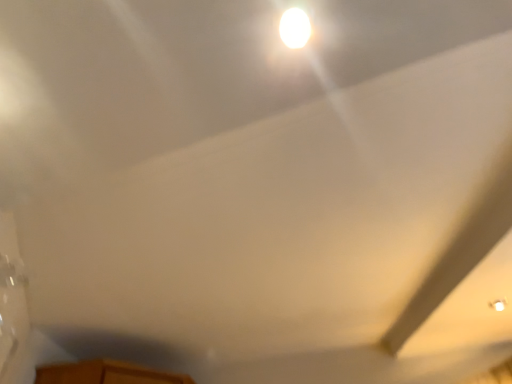
Describe the element at coordinates (464, 279) in the screenshot. Image resolution: width=512 pixels, height=384 pixels. I see `white matte exhaust hood at upper right` at that location.

Locate an element on the screen. white matte exhaust hood at upper right is located at coordinates (464, 279).

Image resolution: width=512 pixels, height=384 pixels. What do you see at coordinates (295, 28) in the screenshot?
I see `white glossy light bulb at upper center` at bounding box center [295, 28].

Where is `white glossy light bulb at upper center`? white glossy light bulb at upper center is located at coordinates (295, 28).

Identify the location of white matte exhaust hood at upper right. click(x=464, y=279).

Which object is positioned more to the left, white glossy light bulb at upper center or white matte exhaust hood at upper right?

white glossy light bulb at upper center.

Is white glossy light bulb at upper center in front of or behind white matte exhaust hood at upper right in the image?

Clearly, white glossy light bulb at upper center is in front of white matte exhaust hood at upper right.

Is point (281, 34) in front of point (495, 216)?

Yes.

From the image's perspective, is white glossy light bulb at upper center positioned above or below white matte exhaust hood at upper right?

white glossy light bulb at upper center is situated higher than white matte exhaust hood at upper right in the image.

From a real-world perspective, between white glossy light bulb at upper center and white matte exhaust hood at upper right, who is vertically higher?

In real-world perspective, white matte exhaust hood at upper right is above.

Considering the sizes of objects white glossy light bulb at upper center and white matte exhaust hood at upper right in the image provided, who is thinner, white glossy light bulb at upper center or white matte exhaust hood at upper right?

Answer: With smaller width is white glossy light bulb at upper center.

Can you confirm if white glossy light bulb at upper center is taller than white matte exhaust hood at upper right?

No, white glossy light bulb at upper center is not taller than white matte exhaust hood at upper right.

Considering the relative sizes of white glossy light bulb at upper center and white matte exhaust hood at upper right in the image provided, is white glossy light bulb at upper center bigger than white matte exhaust hood at upper right?

No.

Do you think white glossy light bulb at upper center is within white matte exhaust hood at upper right, or outside of it?

white glossy light bulb at upper center cannot be found inside white matte exhaust hood at upper right.

Is white glossy light bulb at upper center far from white matte exhaust hood at upper right?

That's right, there is a large distance between white glossy light bulb at upper center and white matte exhaust hood at upper right.

Could you tell me if white glossy light bulb at upper center is facing white matte exhaust hood at upper right?

No.

Can you tell me how much white glossy light bulb at upper center and white matte exhaust hood at upper right differ in facing direction?

They differ by 179 degrees in their facing directions.

Image resolution: width=512 pixels, height=384 pixels. Find the location of `light that appears below the white matte exhaust hood at upper right (from a real-world perspective)`. light that appears below the white matte exhaust hood at upper right (from a real-world perspective) is located at coordinates (295, 28).

Between white matte exhaust hood at upper right and white glossy light bulb at upper center, which one appears on the left side from the viewer's perspective?

Positioned to the left is white glossy light bulb at upper center.

Considering the positions of objects white matte exhaust hood at upper right and white glossy light bulb at upper center in the image provided, who is behind, white matte exhaust hood at upper right or white glossy light bulb at upper center?

Positioned behind is white matte exhaust hood at upper right.

Is point (475, 273) behind point (295, 22)?

Yes, it is.

From the image's perspective, would you say white matte exhaust hood at upper right is positioned over white glossy light bulb at upper center?

No, from the image's perspective, white matte exhaust hood at upper right is not on top of white glossy light bulb at upper center.

From a real-world perspective, is white matte exhaust hood at upper right under white glossy light bulb at upper center?

No.

Which object is wider, white matte exhaust hood at upper right or white glossy light bulb at upper center?

white matte exhaust hood at upper right.

Considering the relative sizes of white matte exhaust hood at upper right and white glossy light bulb at upper center in the image provided, is white matte exhaust hood at upper right taller than white glossy light bulb at upper center?

Yes.

Which of these two, white matte exhaust hood at upper right or white glossy light bulb at upper center, is bigger?

white matte exhaust hood at upper right.

Would you say white matte exhaust hood at upper right contains white glossy light bulb at upper center?

No, white matte exhaust hood at upper right does not contain white glossy light bulb at upper center.

Is white matte exhaust hood at upper right with white glossy light bulb at upper center?

white matte exhaust hood at upper right is not next to white glossy light bulb at upper center, and they're not touching.

Is white matte exhaust hood at upper right facing away from white glossy light bulb at upper center?

white matte exhaust hood at upper right does not have its back to white glossy light bulb at upper center.

Locate an element on the screen. This screenshot has width=512, height=384. exhaust hood lying on the right of white glossy light bulb at upper center is located at coordinates (464, 279).

The image size is (512, 384). I want to click on light below the white matte exhaust hood at upper right (from a real-world perspective), so click(295, 28).

Locate an element on the screen. light on the left of white matte exhaust hood at upper right is located at coordinates (295, 28).